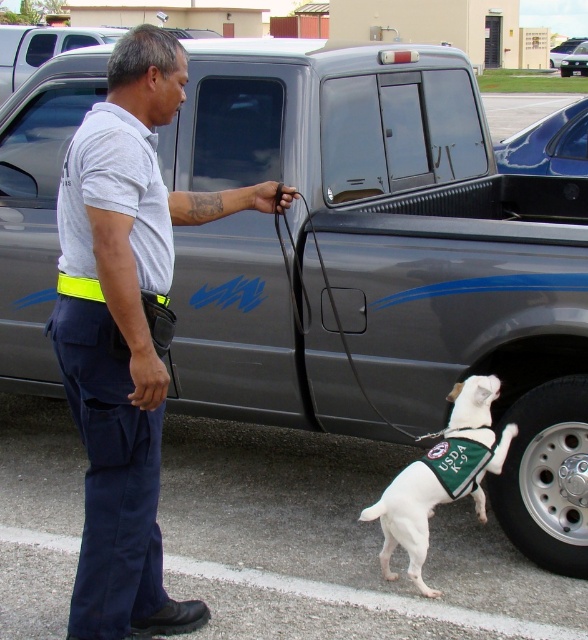
Based on the photo, which is above, silver metallic tire at lower right or white fabric vest at lower right?

silver metallic tire at lower right is higher up.

Is point (546, 499) closer to viewer compared to point (507, 449)?

No, it is not.

You are a GUI agent. You are given a task and a screenshot of the screen. Output one action in this format:
    pyautogui.click(x=<x>, y=<y>)
    Task: Click on the silver metallic tire at lower right
    The image size is (588, 640).
    Given the screenshot: What is the action you would take?
    pyautogui.click(x=546, y=476)

Can you confirm if gray cotton shirt at center is bigger than silver metallic tire at lower right?

Indeed, gray cotton shirt at center has a larger size compared to silver metallic tire at lower right.

Can you confirm if gray cotton shirt at center is positioned to the left of silver metallic tire at lower right?

Yes, gray cotton shirt at center is to the left of silver metallic tire at lower right.

Is point (138, 360) behind point (549, 420)?

No, it is in front of (549, 420).

Find the location of `gray cotton shirt at center`. gray cotton shirt at center is located at coordinates (125, 332).

Does white fabric vest at lower right appear over black rubber leash at center?

Incorrect, white fabric vest at lower right is not positioned above black rubber leash at center.

What do you see at coordinates (442, 476) in the screenshot?
I see `white fabric vest at lower right` at bounding box center [442, 476].

The width and height of the screenshot is (588, 640). I want to click on white fabric vest at lower right, so click(442, 476).